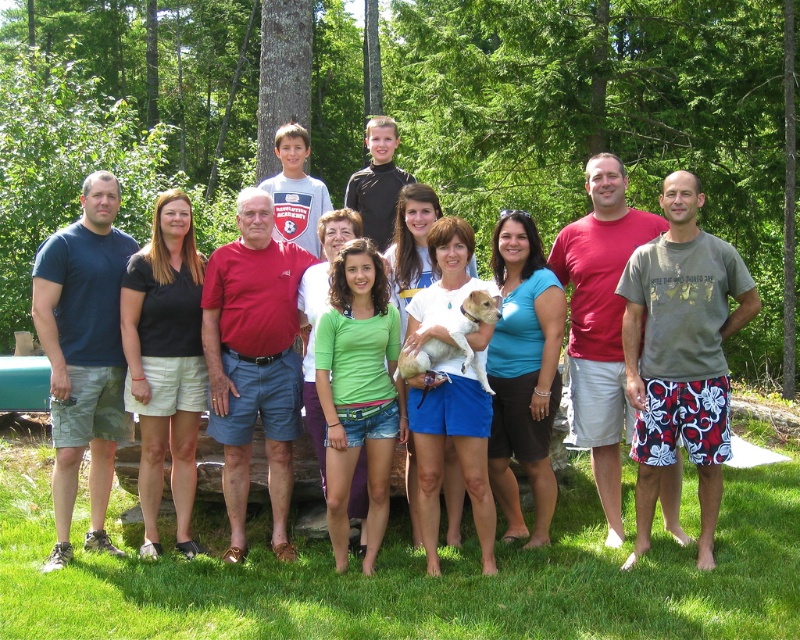
Does point (756, 58) come in front of point (237, 282)?

No, (756, 58) is further to viewer.

Is point (652, 67) behind point (218, 387)?

Yes, point (652, 67) is behind point (218, 387).

The height and width of the screenshot is (640, 800). What are the coordinates of `green leafy tree at center` in the screenshot? It's located at (600, 115).

Is green leafy tree at center to the left of white fur dog at center from the viewer's perspective?

Correct, you'll find green leafy tree at center to the left of white fur dog at center.

Who is more forward, (630, 134) or (468, 353)?

Point (468, 353) is more forward.

You are a GUI agent. You are given a task and a screenshot of the screen. Output one action in this format:
    pyautogui.click(x=<x>, y=<y>)
    Task: Click on the green leafy tree at center
    
    Given the screenshot: What is the action you would take?
    pyautogui.click(x=600, y=115)

Is point (282, 387) farther from viewer compared to point (486, 317)?

Yes, it is behind point (486, 317).

Can you confirm if matte blue shirt at center is positioned below white fur dog at center?

Yes, matte blue shirt at center is below white fur dog at center.

Where is `matte blue shirt at center`? matte blue shirt at center is located at coordinates (277, 307).